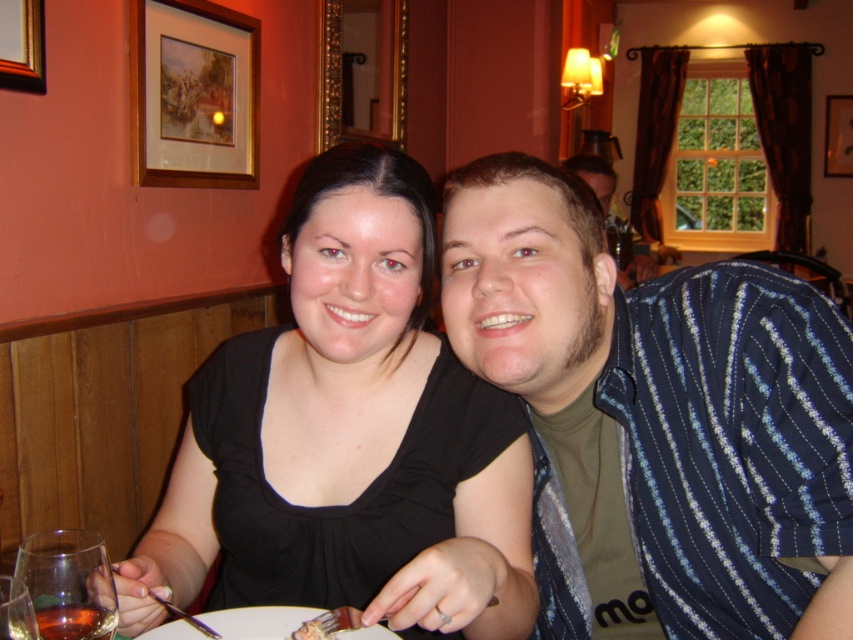
Question: Which object is closer to the camera taking this photo?

Choices:
 (A) gold-framed painting at upper left
 (B) white paper plate at center
 (C) blue striped shirt at right
 (D) wooden picture frame at upper right

Answer: (C)

Question: Which is nearer to the blue striped shirt at right?

Choices:
 (A) blue striped shirt at upper right
 (B) wooden picture frame at upper left
 (C) black matte shirt at center
 (D) gold-framed painting at upper left

Answer: (C)

Question: Is black matte shirt at center closer to camera compared to wooden picture frame at upper right?

Choices:
 (A) yes
 (B) no

Answer: (A)

Question: Can you confirm if black matte shirt at center is wider than blue striped shirt at upper right?

Choices:
 (A) no
 (B) yes

Answer: (A)

Question: Is wooden picture frame at upper left positioned behind amber glass at lower left?

Choices:
 (A) yes
 (B) no

Answer: (A)

Question: Which object is the farthest from the wooden picture frame at upper right?

Choices:
 (A) amber glass at lower left
 (B) wooden picture frame at upper left

Answer: (A)